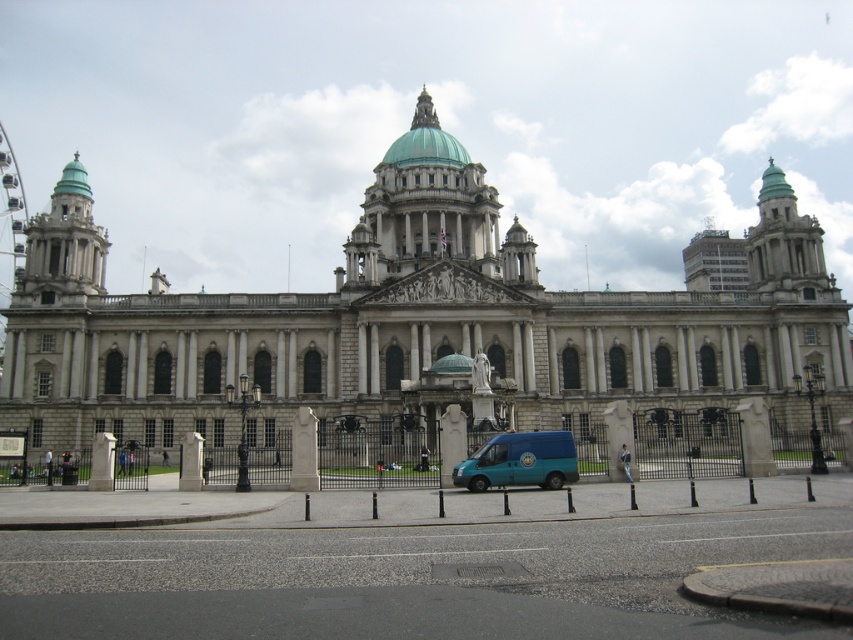
You are a city planner assessing the space in front of the white stone building at center and the teal matte van at center. Based on their sizes, which object occupies more horizontal space in the scene?

The white stone building at center has a larger width than the teal matte van at center, so it occupies more horizontal space in the scene.

You are standing at the point with coordinates (415, 323) in the image. What object is located exactly at that point?

The point at (415, 323) corresponds to the white stone building at center.

You are a photographer planning to capture the white stone building at center and the metallic gray drive at lower center in a single shot. Given that the camera can only focus on one object clearly, which object should you prioritize to ensure it fills most of the frame?

The white stone building at center is larger in size than the metallic gray drive at lower center, so you should prioritize focusing on the white stone building at center to ensure it fills most of the frame.